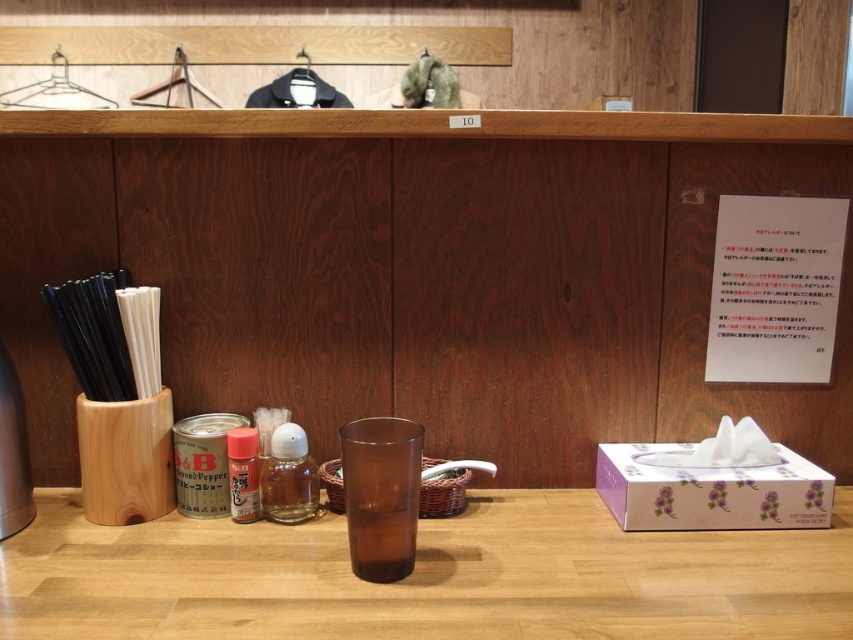
Question: Which object is positioned farthest from the purple floral tissue box at right?

Choices:
 (A) translucent plastic bottle at center
 (B) translucent glass bottle at center
 (C) amber glass at center

Answer: (A)

Question: Among these points, which one is farthest from the camera?

Choices:
 (A) (405, 426)
 (B) (267, 492)
 (C) (809, 573)

Answer: (B)

Question: Based on their relative distances, which object is nearer to the translucent plastic bottle at center?

Choices:
 (A) amber glass at center
 (B) translucent glass bottle at center
 (C) purple floral tissue box at right

Answer: (B)

Question: Can you confirm if purple floral tissue box at right is bigger than translucent plastic bottle at center?

Choices:
 (A) yes
 (B) no

Answer: (A)

Question: Is brown wood table at center thinner than purple floral tissue box at right?

Choices:
 (A) yes
 (B) no

Answer: (B)

Question: Does purple floral tissue box at right come behind amber glass at center?

Choices:
 (A) yes
 (B) no

Answer: (A)